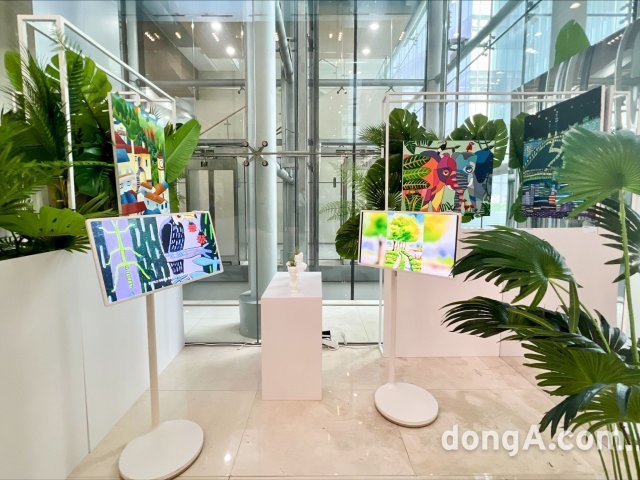
You are a GUI agent. You are given a task and a screenshot of the screen. Output one action in this format:
    pyautogui.click(x=<x>, y=<y>)
    Task: Click on the artwork
    The height and width of the screenshot is (480, 640).
    Given the screenshot: What is the action you would take?
    pyautogui.click(x=429, y=177), pyautogui.click(x=539, y=166), pyautogui.click(x=145, y=182)